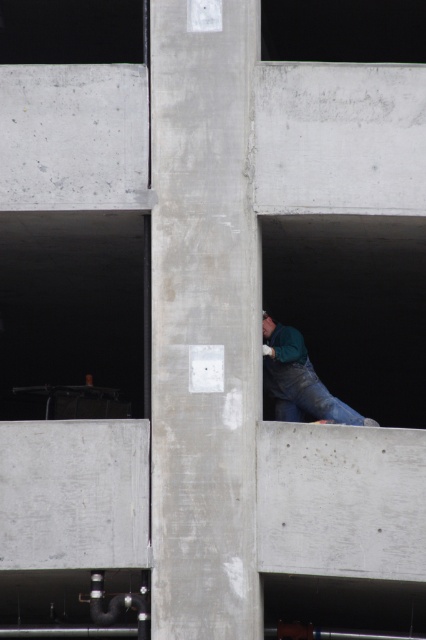
You are a construction worker standing at point (72, 10) and need to reach point (368, 10). Can you walk directly to it without moving around any obstacles?

Point (368, 10) is in front of point (72, 10), so you can walk directly to it without moving around any obstacles.

You are a safety inspector checking the construction site. You notice the black glass window at upper center and the blue denim jeans at lower center. Which object is wider from your perspective?

The black glass window at upper center might be wider than blue denim jeans at lower center according to the description.